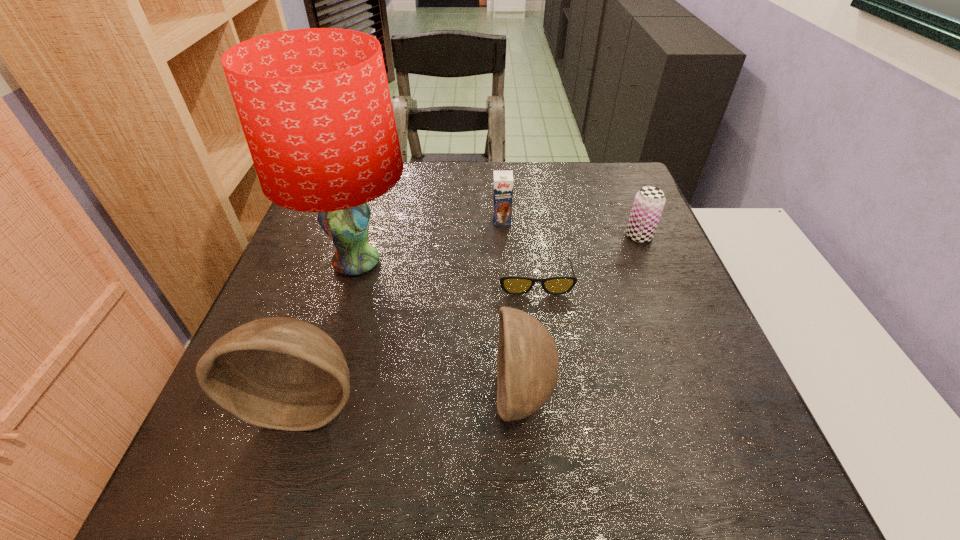
The image size is (960, 540). I want to click on free space between the rightmost object and the right bowl, so coord(581,315).

This screenshot has height=540, width=960. I want to click on vacant space that's between the left bowl and the lampshade, so click(x=330, y=333).

Where is `the closest object relative to the sunglasses`? This screenshot has height=540, width=960. the closest object relative to the sunglasses is located at coordinates (527, 361).

Identify which object is located as the second nearest to the shortest object. Please provide its 2D coordinates. Your answer should be formatted as a tuple, i.e. [(x, y)], where the tuple contains the x and y coordinates of a point satisfying the conditions above.

[(502, 180)]

This screenshot has height=540, width=960. In order to click on vacant space that satisfies the following two spatial constraints: 1. on the back side of the beer can; 2. on the right side of the left bowl in this screenshot , I will do `click(357, 236)`.